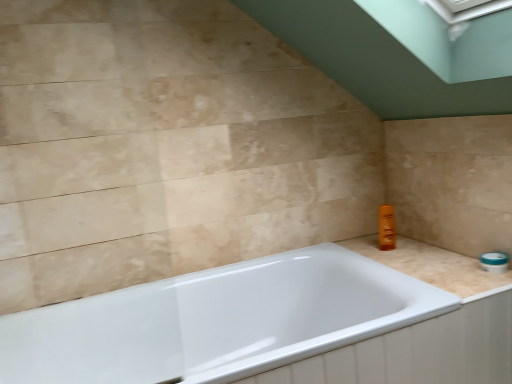
Question: From the image's perspective, is beige marble counter top at right positioned above or below white glossy bathtub at center?

Choices:
 (A) above
 (B) below

Answer: (A)

Question: Considering the relative positions of beige marble counter top at right and white glossy bathtub at center in the image provided, is beige marble counter top at right to the left or to the right of white glossy bathtub at center?

Choices:
 (A) right
 (B) left

Answer: (A)

Question: Considering the positions of beige marble counter top at right and white glossy bathtub at center in the image, is beige marble counter top at right taller or shorter than white glossy bathtub at center?

Choices:
 (A) short
 (B) tall

Answer: (A)

Question: Looking at the image, does white glossy bathtub at center seem bigger or smaller compared to beige marble counter top at right?

Choices:
 (A) big
 (B) small

Answer: (A)

Question: Is point (224, 309) closer or farther from the camera than point (448, 284)?

Choices:
 (A) closer
 (B) farther

Answer: (B)

Question: In the image, is white glossy bathtub at center positioned in front of or behind beige marble counter top at right?

Choices:
 (A) front
 (B) behind

Answer: (A)

Question: Is white glossy bathtub at center taller or shorter than beige marble counter top at right?

Choices:
 (A) tall
 (B) short

Answer: (A)